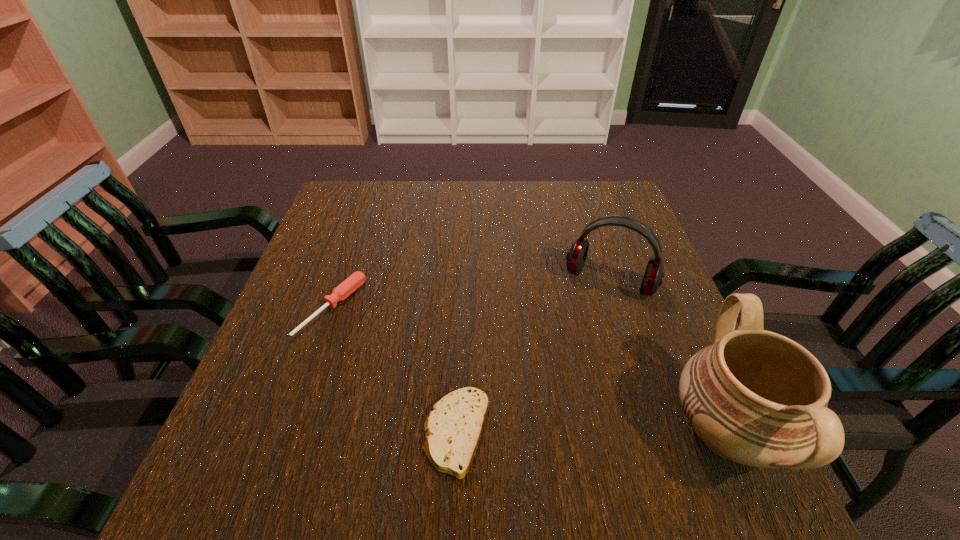
Locate an element on the screen. Image resolution: width=960 pixels, height=540 pixels. pita bread is located at coordinates (453, 428).

This screenshot has height=540, width=960. I want to click on the shortest object, so pyautogui.click(x=453, y=428).

Locate an element on the screen. The image size is (960, 540). the tallest object is located at coordinates (755, 397).

Image resolution: width=960 pixels, height=540 pixels. Find the location of `the second tallest object`. the second tallest object is located at coordinates (576, 256).

Locate an element on the screen. The height and width of the screenshot is (540, 960). the second shortest object is located at coordinates (347, 287).

Locate an element on the screen. The image size is (960, 540). screwdriver is located at coordinates (347, 287).

The width and height of the screenshot is (960, 540). What are the coordinates of `vacant space located on the left of the pita bread` in the screenshot? It's located at (x=368, y=433).

In order to click on vacant space located on the front-facing side of the urn in this screenshot , I will do `click(520, 433)`.

Image resolution: width=960 pixels, height=540 pixels. In order to click on vacant space situated on the front-facing side of the urn in this screenshot , I will do `click(560, 433)`.

Locate an element on the screen. Image resolution: width=960 pixels, height=540 pixels. vacant space located on the front-facing side of the urn is located at coordinates (588, 433).